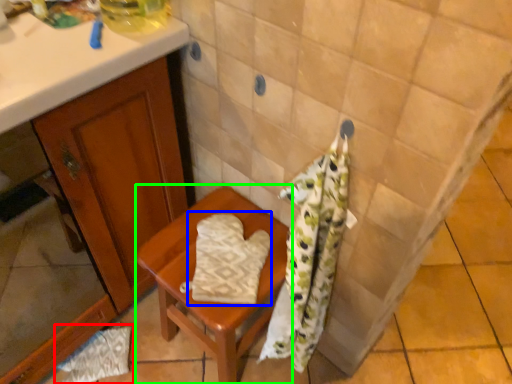
Question: Which object is the closest to the material (highlighted by a red box)? Choose among these: beach towel (highlighted by a blue box) or furniture (highlighted by a green box).

Choices:
 (A) beach towel
 (B) furniture

Answer: (B)